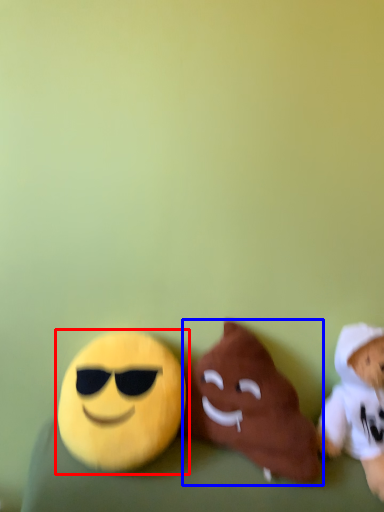
Question: Which object appears farthest to the camera in this image, toy (highlighted by a red box) or toy (highlighted by a blue box)?

Choices:
 (A) toy
 (B) toy

Answer: (A)